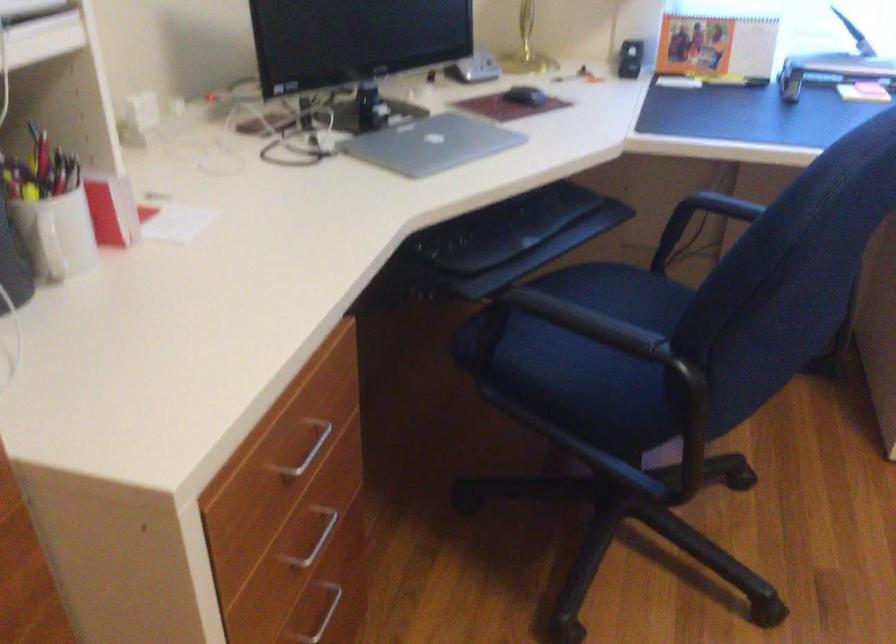
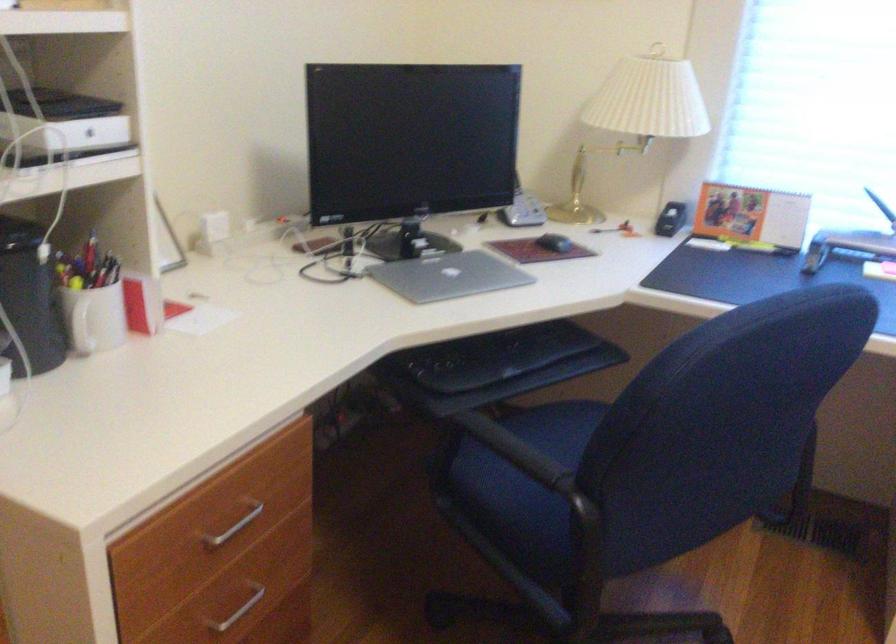
The point at (588,328) is marked in the first image. Where is the corresponding point in the second image?

(513, 450)